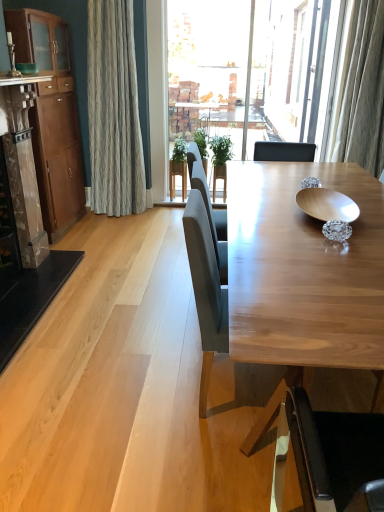
Question: From the image's perspective, is marble fireplace at left located above light brown wood chair at center, acting as the 2th chair starting from the back?

Choices:
 (A) yes
 (B) no

Answer: (A)

Question: Does marble fireplace at left have a greater height compared to light brown wood chair at center, acting as the 2th chair starting from the back?

Choices:
 (A) yes
 (B) no

Answer: (A)

Question: Would you say marble fireplace at left is a long distance from light brown wood chair at center, arranged as the 1th chair when viewed from the front?

Choices:
 (A) yes
 (B) no

Answer: (A)

Question: Is marble fireplace at left wider than light brown wood chair at center, acting as the 2th chair starting from the back?

Choices:
 (A) yes
 (B) no

Answer: (B)

Question: Is marble fireplace at left outside light brown wood chair at center, arranged as the 1th chair when viewed from the front?

Choices:
 (A) no
 (B) yes

Answer: (B)

Question: Would you say brown wood cabinet at left is to the left or to the right of wooden bowl at center in the picture?

Choices:
 (A) right
 (B) left

Answer: (B)

Question: In terms of height, does brown wood cabinet at left look taller or shorter compared to wooden bowl at center?

Choices:
 (A) short
 (B) tall

Answer: (B)

Question: Is brown wood cabinet at left wider or thinner than wooden bowl at center?

Choices:
 (A) thin
 (B) wide

Answer: (B)

Question: From the image's perspective, is brown wood cabinet at left located above or below wooden bowl at center?

Choices:
 (A) below
 (B) above

Answer: (B)

Question: In terms of height, does marble fireplace at left look taller or shorter compared to matte gray chair at center, the second chair viewed from the front?

Choices:
 (A) short
 (B) tall

Answer: (B)

Question: Relative to matte gray chair at center, the second chair viewed from the front, is marble fireplace at left in front or behind?

Choices:
 (A) behind
 (B) front

Answer: (A)

Question: From a real-world perspective, relative to matte gray chair at center, the 1th chair viewed from the back, is marble fireplace at left vertically above or below?

Choices:
 (A) below
 (B) above

Answer: (B)

Question: Visually, is marble fireplace at left positioned to the left or to the right of matte gray chair at center, the 1th chair viewed from the back?

Choices:
 (A) right
 (B) left

Answer: (B)

Question: Is green leafy plant at center to the left or to the right of matte wood counter top at upper left in the image?

Choices:
 (A) left
 (B) right

Answer: (B)

Question: From a real-world perspective, is green leafy plant at center above or below matte wood counter top at upper left?

Choices:
 (A) above
 (B) below

Answer: (B)